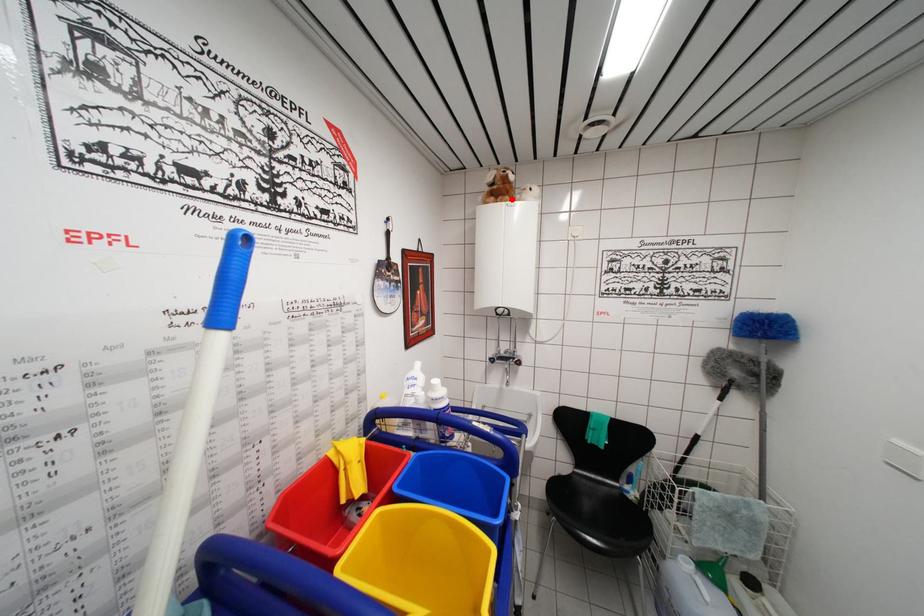
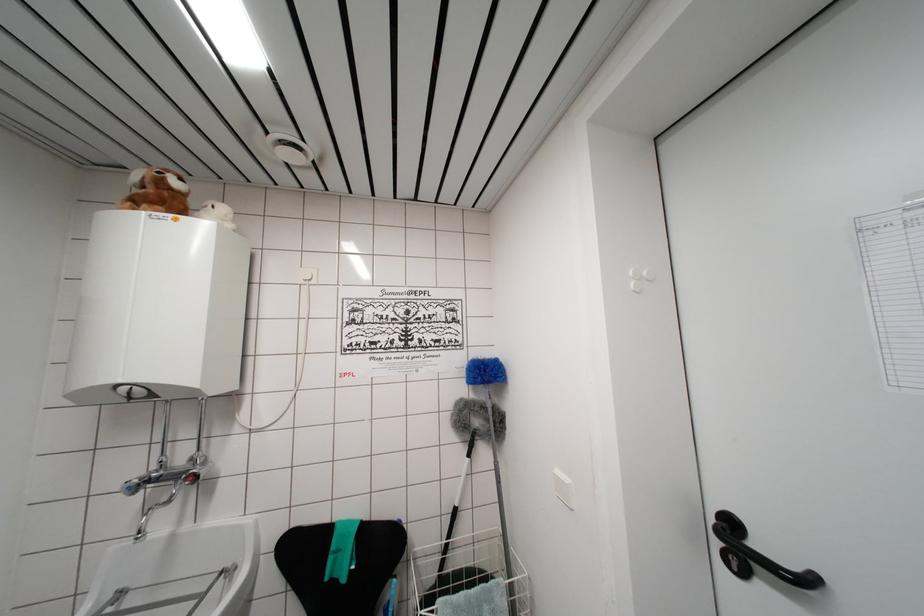
Locate, in the second image, the point that corresponds to the highlighted location in the first image.

(168, 209)